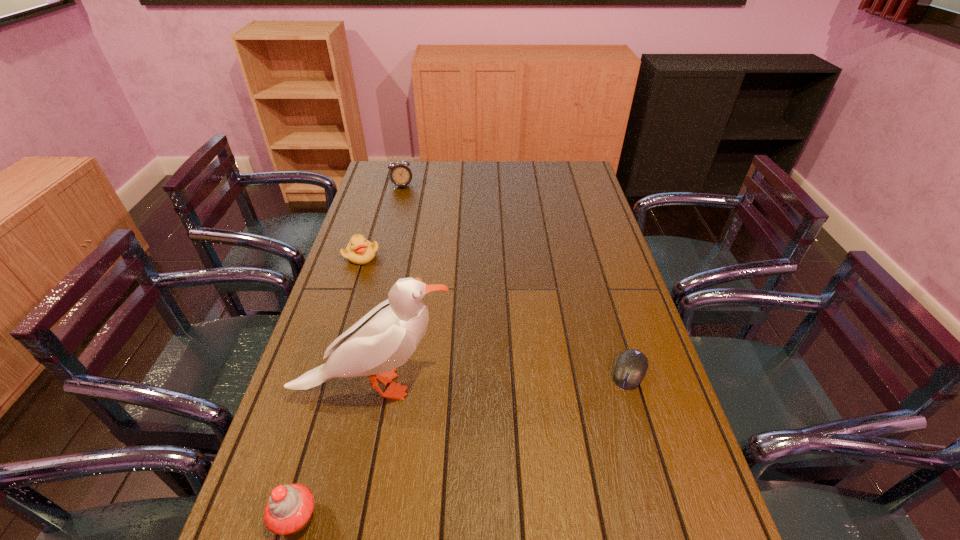
Locate an element on the screen. This screenshot has height=540, width=960. vacant space on the desktop that is between the cupcake and the rightmost object and is positioned on the face of the farthest object is located at coordinates (510, 424).

Find the location of a particular element. This screenshot has height=540, width=960. free spot on the desktop that is between the cupcake and the computer mouse and is positioned at the face of the fourth nearest object is located at coordinates [x=528, y=416].

Image resolution: width=960 pixels, height=540 pixels. Identify the location of vacant space on the desktop that is between the nearest object and the computer mouse and is positioned at the beak of the tallest object. (531, 415).